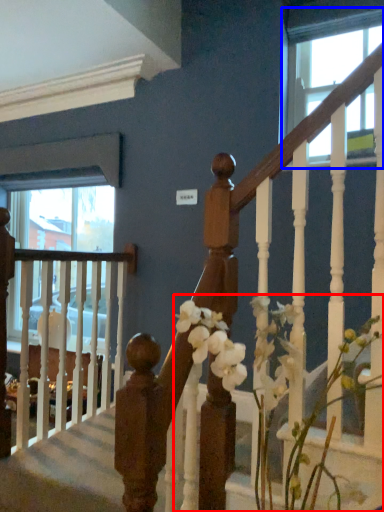
Question: Among these objects, which one is farthest to the camera, floral arrangement (highlighted by a red box) or window (highlighted by a blue box)?

Choices:
 (A) floral arrangement
 (B) window

Answer: (B)